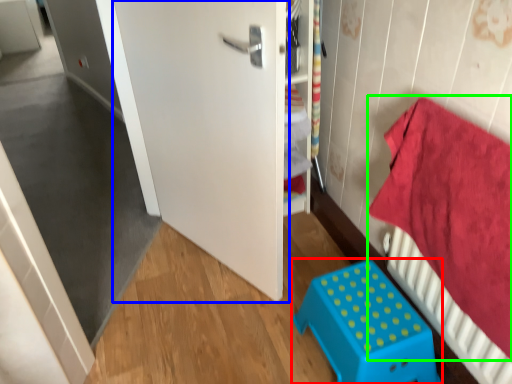
Question: Estimate the real-world distances between objects in this image. Which object is closer to furniture (highlighted by a red box), door (highlighted by a blue box) or bedding (highlighted by a green box)?

Choices:
 (A) door
 (B) bedding

Answer: (B)